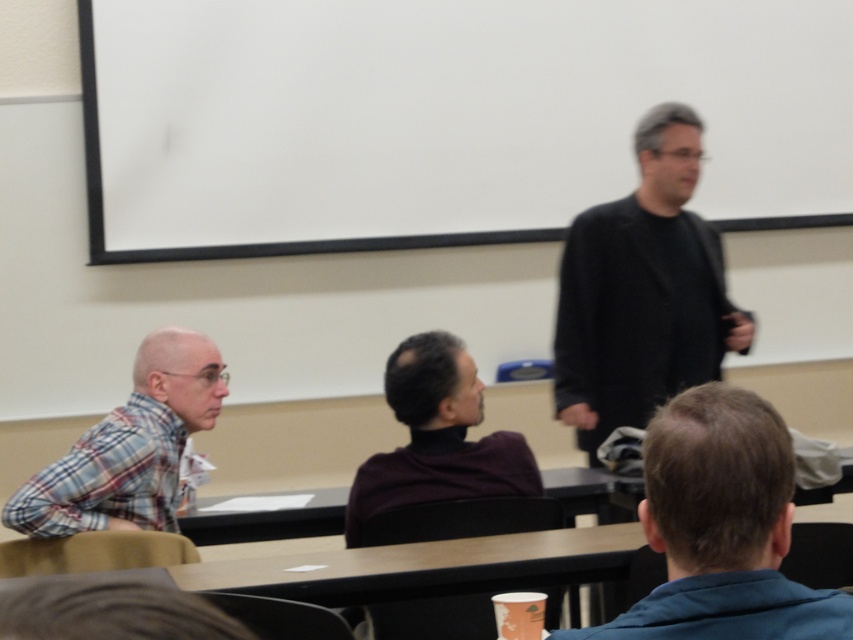
You are an event planner setting up chairs for a small gathering. You need to place a chair that is 2 feet wide between the black matte jacket at upper right and the dark blue fabric at lower right. Is there enough space?

The black matte jacket at upper right is 6.21 feet from the dark blue fabric at lower right. Since the chair is only 2 feet wide, there is sufficient space to place it between them.

You are a photographer trying to capture a clear shot of the speaker. You notice two items in the frame that might block your view. The black matte jacket at upper right and the dark purple turtleneck sweater at center. Which of these items is more likely to obstruct your view of the speaker?

The black matte jacket at upper right is more likely to obstruct your view of the speaker because it is much taller than the dark purple turtleneck sweater at center.